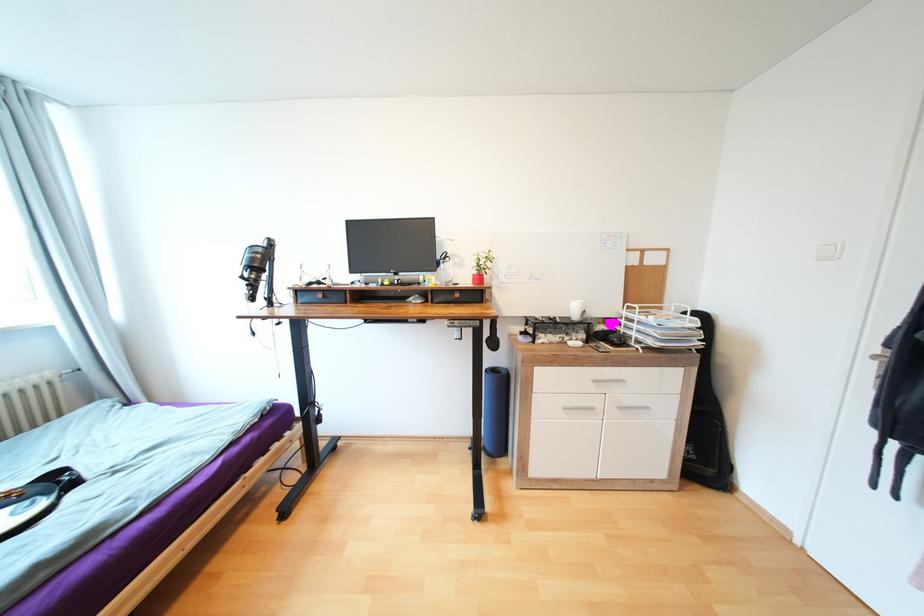
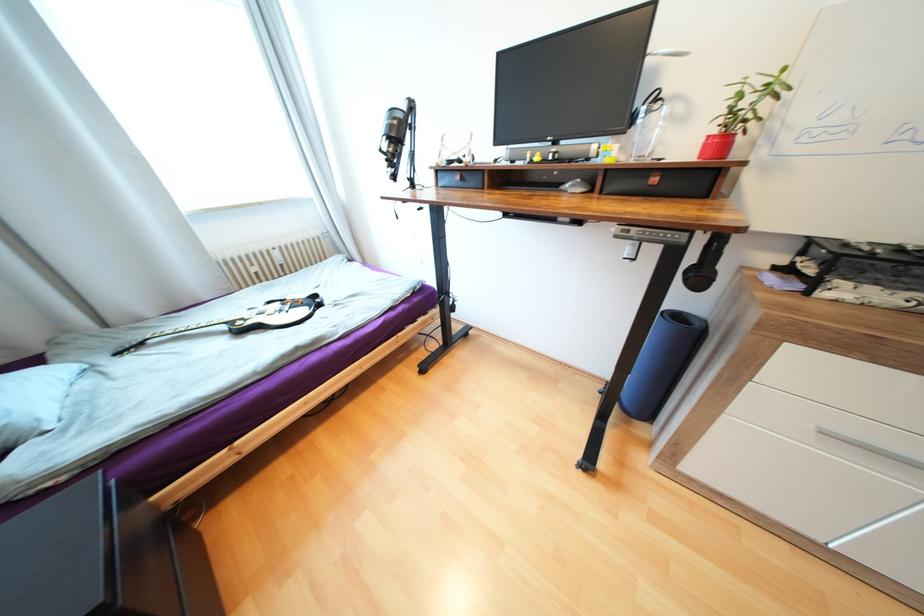
The point at (417, 300) is marked in the first image. Where is the corresponding point in the second image?

(574, 185)